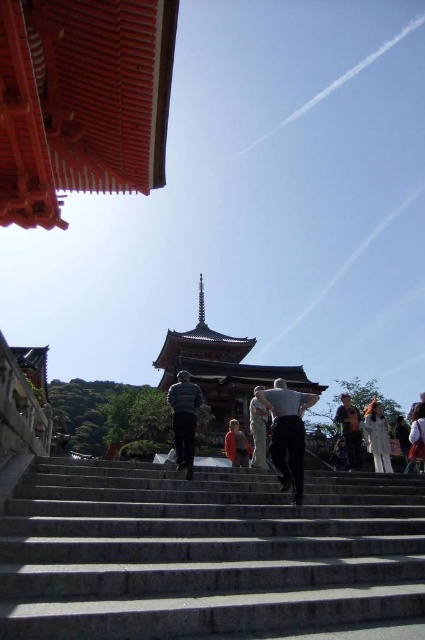
Is light gray fabric pants at center wider than white cotton shirt at right?

Yes.

The image size is (425, 640). I want to click on light gray fabric pants at center, so click(288, 433).

I want to click on light gray fabric pants at center, so click(288, 433).

Is striped sweater at center bigger than light beige fabric jacket at center?

No.

Which is more to the right, striped sweater at center or light beige fabric jacket at center?

light beige fabric jacket at center is more to the right.

Identify the location of striped sweater at center. (184, 419).

Is gray stone stairs at center behind light beige pants at center?

No.

Does gray stone stairs at center have a greater width compared to light beige pants at center?

Yes.

Between point (113, 602) and point (254, 461), which one is positioned behind?

Point (254, 461)

Where is `gray stone stairs at center`? The width and height of the screenshot is (425, 640). gray stone stairs at center is located at coordinates (206, 554).